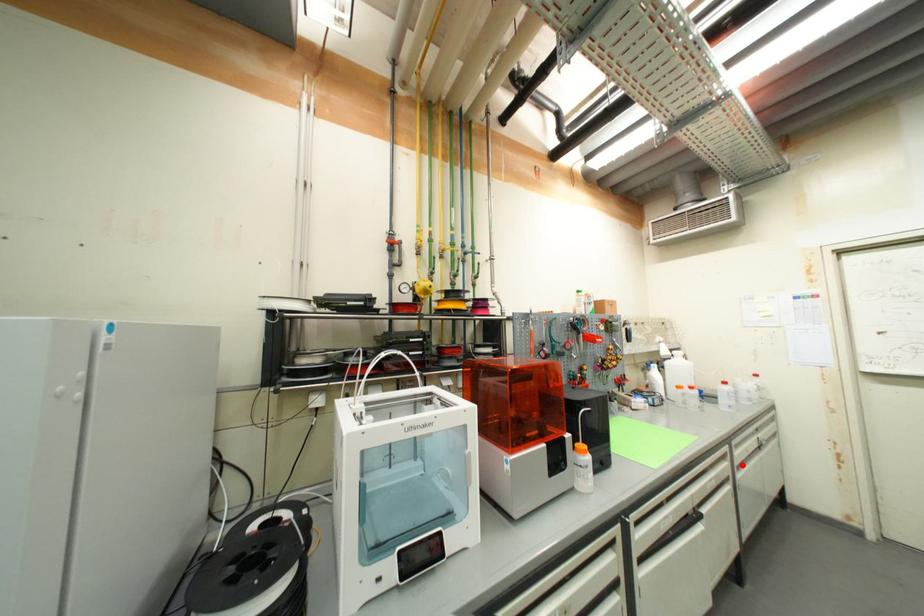
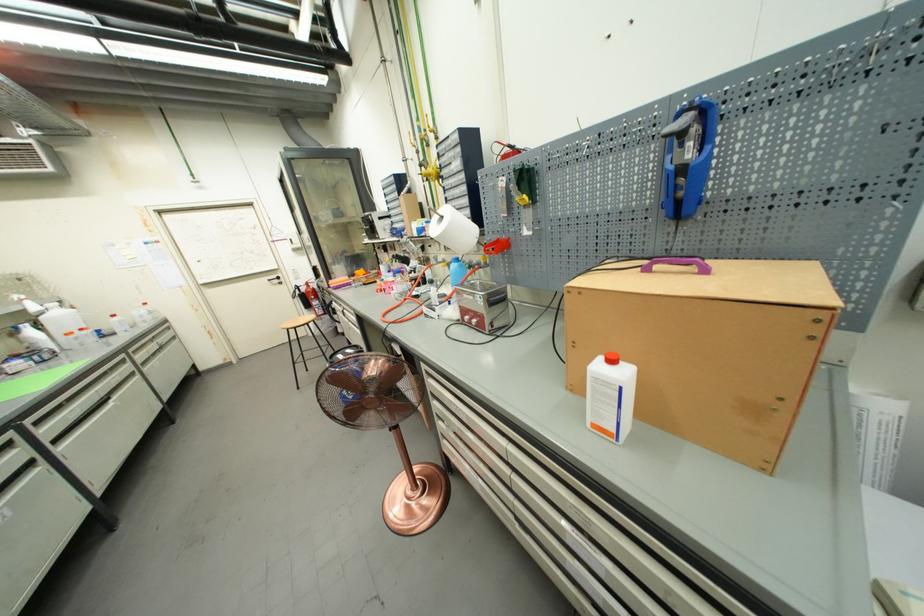
Where in the second image is the point corresponding to the highlighted location from the first image?

(146, 363)